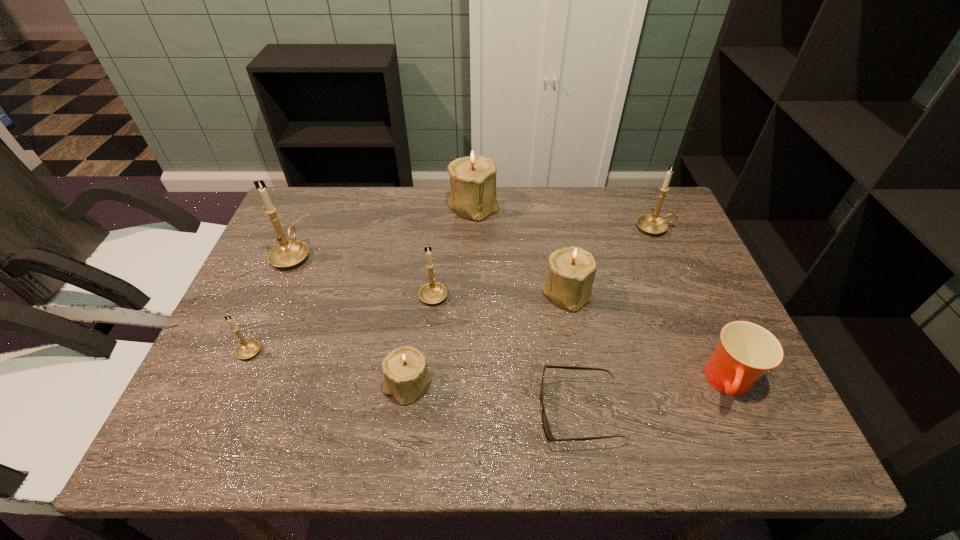
The height and width of the screenshot is (540, 960). Find the location of `vacant area situated 0.200m on the handle side of the second smallest gold candle holder`. vacant area situated 0.200m on the handle side of the second smallest gold candle holder is located at coordinates (440, 231).

Identify the location of vacant space located on the handle side of the second smallest gold candle holder. (441, 218).

The height and width of the screenshot is (540, 960). Identify the location of vacant region located on the handle side of the second smallest gold candle holder. (436, 267).

This screenshot has width=960, height=540. In order to click on vacant region located on the right of the second biggest beige candle_holder in this screenshot , I will do `click(698, 292)`.

You are a GUI agent. You are given a task and a screenshot of the screen. Output one action in this format:
    pyautogui.click(x=<x>, y=<y>)
    Task: Click on the vacant area situated 0.230m on the handle side of the smallest gold candle holder
    Image resolution: width=960 pixels, height=540 pixels.
    Given the screenshot: What is the action you would take?
    pyautogui.click(x=286, y=267)

Where is `blank space located on the handle side of the smallest gold candle holder`? The height and width of the screenshot is (540, 960). blank space located on the handle side of the smallest gold candle holder is located at coordinates point(284,273).

The width and height of the screenshot is (960, 540). Find the location of `free spot located 0.380m on the handle side of the smallest gold candle holder`. free spot located 0.380m on the handle side of the smallest gold candle holder is located at coordinates (301, 231).

This screenshot has height=540, width=960. Identify the location of free location located 0.320m on the left of the smallest beige candle_holder. (232, 385).

This screenshot has width=960, height=540. I want to click on free spot located on the back of the cup, so click(x=692, y=298).

Locate an element on the screen. This screenshot has height=540, width=960. free space located 0.230m on the lenses of the sunglasses is located at coordinates (426, 411).